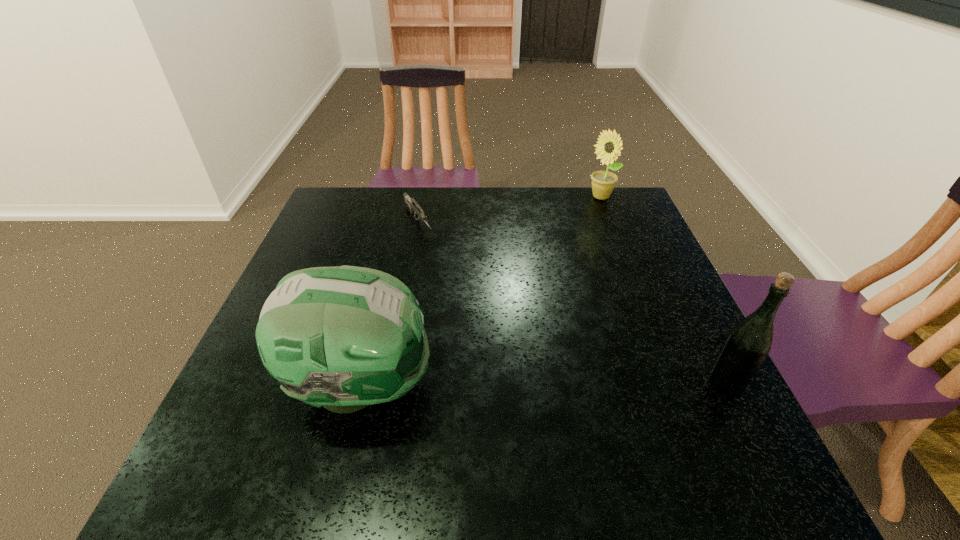
The image size is (960, 540). Find the location of `football helmet`. football helmet is located at coordinates (345, 337).

You are a GUI agent. You are given a task and a screenshot of the screen. Output one action in this format:
    pyautogui.click(x=<x>, y=<y>)
    Task: Click on the rightmost object
    This screenshot has width=960, height=540.
    Given the screenshot: What is the action you would take?
    pyautogui.click(x=749, y=342)

Locate an element on the screen. This screenshot has height=540, width=960. the second shortest object is located at coordinates (609, 145).

Locate an element on the screen. This screenshot has height=540, width=960. sunflower is located at coordinates (609, 145).

At what (x,y) coordinates should I click in order to perform the action: click on the shortest object. Please return your answer as a coordinate pair (x, y). Looking at the image, I should click on (412, 204).

Find the location of a particular element. The height and width of the screenshot is (540, 960). free space located on the visor of the football helmet is located at coordinates (616, 386).

Image resolution: width=960 pixels, height=540 pixels. What are the coordinates of `blank area located on the back of the beer bottle` in the screenshot? It's located at (698, 329).

Where is `free region located 0.380m on the face of the sunflower`? This screenshot has width=960, height=540. free region located 0.380m on the face of the sunflower is located at coordinates (578, 282).

You are a GUI agent. You are given a task and a screenshot of the screen. Output one action in this format:
    pyautogui.click(x=<x>, y=<y>)
    Task: Click on the vacant space located 0.060m on the face of the sunflower
    
    Given the screenshot: What is the action you would take?
    pyautogui.click(x=596, y=215)

Image resolution: width=960 pixels, height=540 pixels. Identify the location of free space located 0.210m on the face of the sunflower. (588, 244).